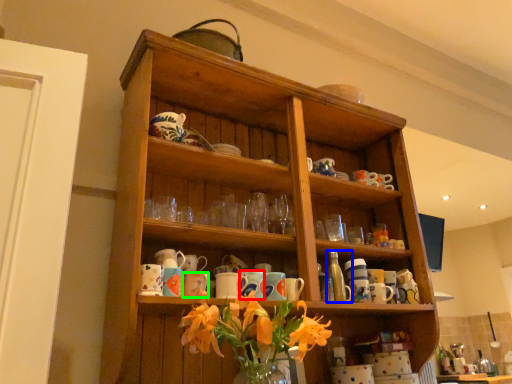
Question: Estimate the real-world distances between objects in this image. Which object is farther from mug (highlighted by a red box), bottle (highlighted by a blue box) or mug (highlighted by a green box)?

Choices:
 (A) bottle
 (B) mug

Answer: (A)